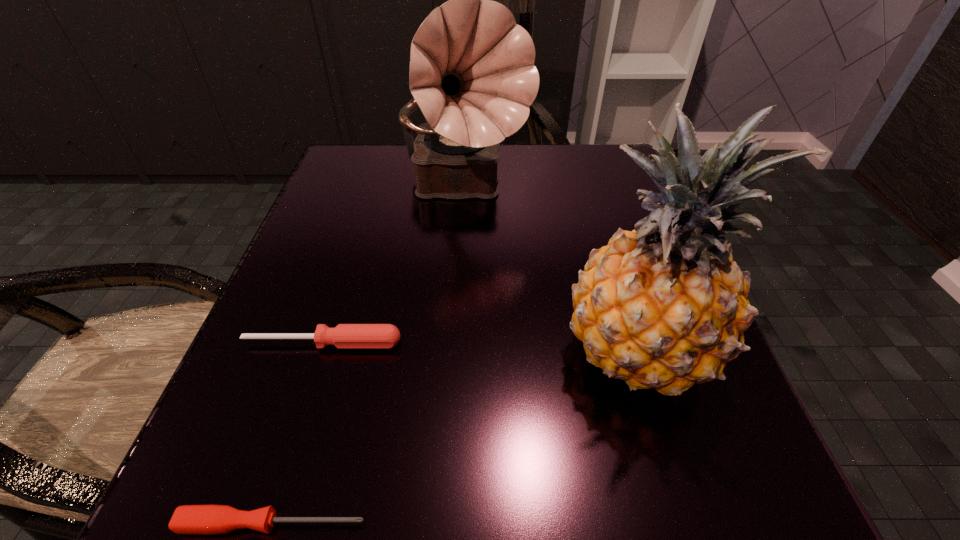
The width and height of the screenshot is (960, 540). In order to click on free space at the far right corner in this screenshot , I will do `click(565, 151)`.

The image size is (960, 540). Find the location of `free spot at the near right corner of the desktop`. free spot at the near right corner of the desktop is located at coordinates tap(693, 523).

The image size is (960, 540). Identify the location of free space between the rightmost object and the record player. (550, 269).

You are a GUI agent. You are given a task and a screenshot of the screen. Output one action in this format:
    pyautogui.click(x=<x>, y=<y>)
    Task: Click on the free space between the shorter screwdriver and the record player
    This screenshot has height=540, width=960.
    Given the screenshot: What is the action you would take?
    pyautogui.click(x=369, y=356)

Locate an element on the screen. The height and width of the screenshot is (540, 960). blank region between the shorter screwdriver and the rightmost object is located at coordinates (455, 436).

Locate an element on the screen. The image size is (960, 540). empty space between the farthest object and the pineapple is located at coordinates (550, 269).

You are a GUI agent. You are given a task and a screenshot of the screen. Output one action in this format:
    pyautogui.click(x=<x>, y=<y>)
    Task: Click on the vacant region between the farthest object and the pineapple
    
    Given the screenshot: What is the action you would take?
    pyautogui.click(x=550, y=269)

Where is `free spot between the taller screwdriver and the shortest object`? The image size is (960, 540). free spot between the taller screwdriver and the shortest object is located at coordinates (298, 434).

Identify the location of vacant area between the record player and the shorter screwdriver. The width and height of the screenshot is (960, 540). (369, 356).

You are a GUI agent. You are given a task and a screenshot of the screen. Output one action in this format:
    pyautogui.click(x=<x>, y=<y>)
    Task: Click on the vacant area between the taller screwdriver and the rightmost object
    This screenshot has height=540, width=960.
    Given the screenshot: What is the action you would take?
    pyautogui.click(x=480, y=346)